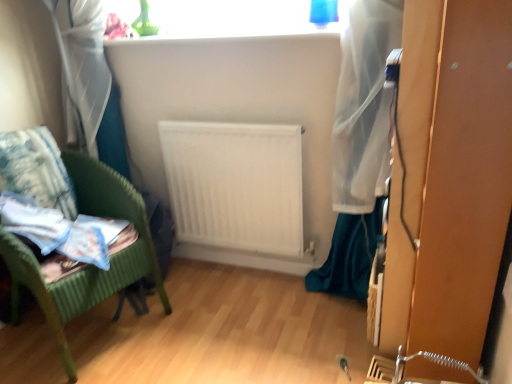
The height and width of the screenshot is (384, 512). What are the coordinates of `free space below green wicker chair at left (from a real-world perspective)` in the screenshot? It's located at tap(98, 328).